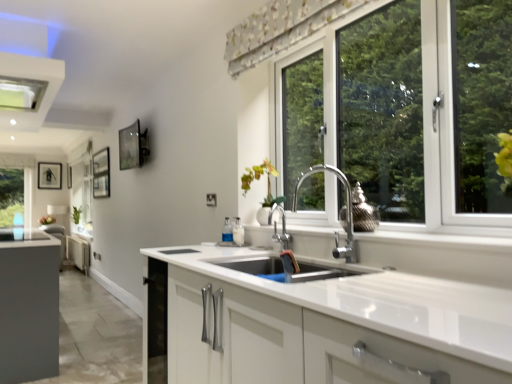
Measure the distance between matte black picture frame at left, which is counted as the 2th picture frame, starting from the right, and camera.

matte black picture frame at left, which is counted as the 2th picture frame, starting from the right, and camera are 27.37 feet apart from each other.

Locate an element on the screen. Image resolution: width=512 pixels, height=384 pixels. white matte cabinet at center is located at coordinates (231, 334).

Describe the element at coordinates (27, 90) in the screenshot. I see `white plastic exhaust hood at upper left` at that location.

What do you see at coordinates (76, 214) in the screenshot?
I see `green matte plant at left` at bounding box center [76, 214].

The height and width of the screenshot is (384, 512). I want to click on floral fabric curtain at upper center, so click(x=280, y=29).

Which object is closer to the camera taking this photo, white plastic exhaust hood at upper left or white matte cabinet at center?

white matte cabinet at center is in front.

From the image's perspective, who appears lower, white plastic exhaust hood at upper left or white matte cabinet at center?

white matte cabinet at center is shown below in the image.

The width and height of the screenshot is (512, 384). I want to click on cabinetry lying on the right of white plastic exhaust hood at upper left, so click(x=231, y=334).

Locate an element on the screen. The image size is (512, 384). plant below the white plastic exhaust hood at upper left (from the image's perspective) is located at coordinates (76, 214).

Which is more to the left, green matte plant at left or white plastic exhaust hood at upper left?

From the viewer's perspective, green matte plant at left appears more on the left side.

Does green matte plant at left touch white plastic exhaust hood at upper left?

No, green matte plant at left is not touching white plastic exhaust hood at upper left.

Measure the distance between white matte cabinet at center and floral fabric curtain at upper center.

A distance of 4.45 feet exists between white matte cabinet at center and floral fabric curtain at upper center.

Can floral fabric curtain at upper center be found inside white matte cabinet at center?

No, floral fabric curtain at upper center is not a part of white matte cabinet at center.

From the image's perspective, which one is positioned higher, white matte cabinet at center or floral fabric curtain at upper center?

floral fabric curtain at upper center appears higher in the image.

Which of these two, white matte cabinet at center or floral fabric curtain at upper center, is smaller?

Smaller between the two is floral fabric curtain at upper center.

Is white plastic exhaust hood at upper left wider than floral fabric curtain at upper center?

Correct, the width of white plastic exhaust hood at upper left exceeds that of floral fabric curtain at upper center.

In the image, is white plastic exhaust hood at upper left positioned in front of or behind floral fabric curtain at upper center?

white plastic exhaust hood at upper left is positioned farther from the viewer than floral fabric curtain at upper center.

Are white plastic exhaust hood at upper left and floral fabric curtain at upper center far apart?

Yes, white plastic exhaust hood at upper left and floral fabric curtain at upper center are quite far apart.

Does white plastic exhaust hood at upper left appear on the right side of floral fabric curtain at upper center?

No.

In terms of size, does green matte plant at left appear bigger or smaller than matte black picture frame at left, which is the first picture frame from left to right?

In the image, green matte plant at left appears to be larger than matte black picture frame at left, which is the first picture frame from left to right.

Between point (72, 212) and point (53, 166), which one is positioned behind?

The point (53, 166) is behind.

Looking at this image, from the image's perspective, which is below, green matte plant at left or matte black picture frame at left, which is the first picture frame from left to right?

green matte plant at left.

Could you tell me if green matte plant at left is turned towards matte black picture frame at left, the first picture frame viewed from the back?

No, green matte plant at left does not turn towards matte black picture frame at left, the first picture frame viewed from the back.

Which of these two, metallic glass picture frame at upper left, marked as the 1th picture frame in a front-to-back arrangement, or white glossy vase at center, is wider?

Wider between the two is white glossy vase at center.

Is metallic glass picture frame at upper left, the 2th picture frame from the left, oriented away from white glossy vase at center?

metallic glass picture frame at upper left, the 2th picture frame from the left, is not turned away from white glossy vase at center.

In the image, is metallic glass picture frame at upper left, the 2th picture frame from the left, on the left side or the right side of white glossy vase at center?

In the image, metallic glass picture frame at upper left, the 2th picture frame from the left, appears on the left side of white glossy vase at center.

Is white glossy vase at center inside the boundaries of floral fabric curtain at upper center, or outside?

white glossy vase at center is outside floral fabric curtain at upper center.

In terms of width, does white glossy vase at center look wider or thinner when compared to floral fabric curtain at upper center?

Clearly, white glossy vase at center has more width compared to floral fabric curtain at upper center.

Is white glossy vase at center positioned before floral fabric curtain at upper center?

No, white glossy vase at center is behind floral fabric curtain at upper center.

Locate an element on the screen. This screenshot has height=384, width=512. cabinetry directly beneath the white plastic exhaust hood at upper left (from a real-world perspective) is located at coordinates (231, 334).

You are a GUI agent. You are given a task and a screenshot of the screen. Output one action in this format:
    pyautogui.click(x=<x>, y=<y>)
    Task: Click on the exhaust hood located above the green matte plant at left (from a real-world perspective)
    The image size is (512, 384).
    Given the screenshot: What is the action you would take?
    pyautogui.click(x=27, y=90)

Looking at the image, which one is located closer to matte black picture frame at left, the first picture frame viewed from the back, white plastic exhaust hood at upper left or green matte plant at left?

green matte plant at left lies closer to matte black picture frame at left, the first picture frame viewed from the back, than the other object.

Looking at the image, which one is located closer to white matte cabinet at center, white plastic exhaust hood at upper left or metallic glass picture frame at upper left, the 2th picture frame from the left?

Among the two, white plastic exhaust hood at upper left is located nearer to white matte cabinet at center.

Based on their spatial positions, is metallic glass picture frame at upper left, acting as the 2th picture frame starting from the back, or white matte cabinet at center closer to matte black picture frame at left, the first picture frame viewed from the back?

metallic glass picture frame at upper left, acting as the 2th picture frame starting from the back, lies closer to matte black picture frame at left, the first picture frame viewed from the back, than the other object.

Estimate the real-world distances between objects in this image. Which object is closer to white matte cabinet at center, metallic glass picture frame at upper left, acting as the 2th picture frame starting from the back, or white glossy vase at center?

white glossy vase at center lies closer to white matte cabinet at center than the other object.

Based on their spatial positions, is matte black picture frame at left, which is the first picture frame from left to right, or white matte cabinet at center closer to green matte plant at left?

matte black picture frame at left, which is the first picture frame from left to right, lies closer to green matte plant at left than the other object.

Looking at the image, which one is located further to metallic glass picture frame at upper left, placed as the 1th picture frame when sorted from right to left, white matte cabinet at center or green matte plant at left?

green matte plant at left lies further to metallic glass picture frame at upper left, placed as the 1th picture frame when sorted from right to left, than the other object.

When comparing their distances from green matte plant at left, does white glossy vase at center or metallic glass picture frame at upper left, the 2th picture frame from the left, seem further?

Based on the image, white glossy vase at center appears to be further to green matte plant at left.

Estimate the real-world distances between objects in this image. Which object is further from white matte cabinet at center, white glossy vase at center or matte black picture frame at left, which is the first picture frame from left to right?

Among the two, matte black picture frame at left, which is the first picture frame from left to right, is located further to white matte cabinet at center.

Locate an element on the screen. Image resolution: width=512 pixels, height=384 pixels. flower between floral fabric curtain at upper center and metallic glass picture frame at upper left, marked as the 1th picture frame in a front-to-back arrangement, along the z-axis is located at coordinates (259, 179).

The height and width of the screenshot is (384, 512). I want to click on picture frame between white glossy vase at center and green matte plant at left in the front-back direction, so click(x=133, y=147).

This screenshot has height=384, width=512. I want to click on cabinetry located between white plastic exhaust hood at upper left and white glossy vase at center in the left-right direction, so click(x=231, y=334).

Where is `plant positioned between white matte cabinet at center and matte black picture frame at left, which is the first picture frame from left to right, from near to far`? The image size is (512, 384). plant positioned between white matte cabinet at center and matte black picture frame at left, which is the first picture frame from left to right, from near to far is located at coordinates (76, 214).